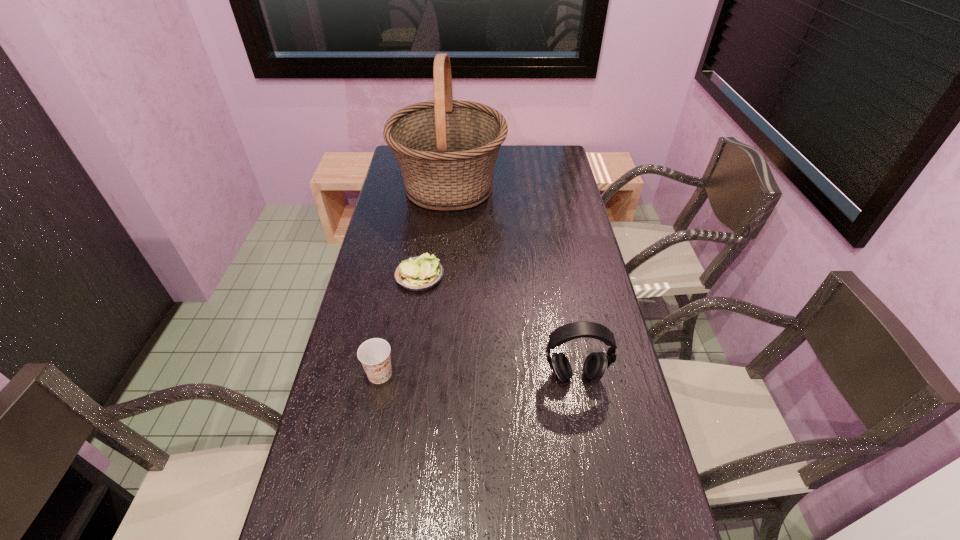
Where is `the second closest object relative to the farthest object`? This screenshot has width=960, height=540. the second closest object relative to the farthest object is located at coordinates (374, 354).